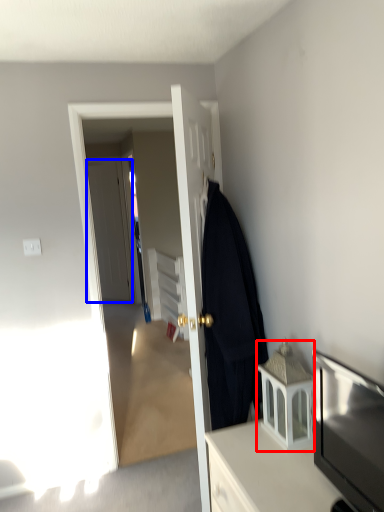
Question: Which object appears farthest to the camera in this image, cabinetry (highlighted by a red box) or door (highlighted by a blue box)?

Choices:
 (A) cabinetry
 (B) door

Answer: (B)